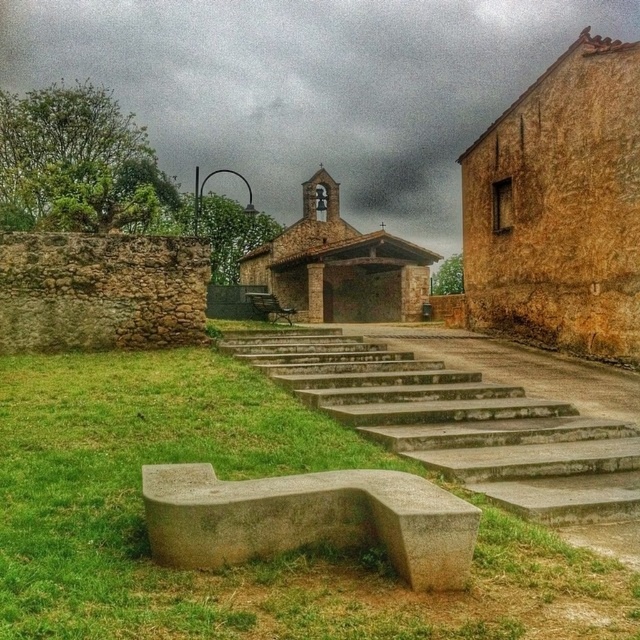
Question: Can you confirm if brown rough stone church at upper right is positioned above brown stone church at center?

Choices:
 (A) yes
 (B) no

Answer: (B)

Question: Estimate the real-world distances between objects in this image. Which object is farther from the brown rough stone church at upper right?

Choices:
 (A) gray concrete bench at lower left
 (B) green grass at lower left
 (C) brown stone church at center

Answer: (C)

Question: Which object is closer to the camera taking this photo?

Choices:
 (A) gray concrete bench at lower left
 (B) concrete stairs at center

Answer: (A)

Question: Which point is farther to the camera?

Choices:
 (A) (516, 99)
 (B) (611, 497)
 (C) (428, 486)

Answer: (A)

Question: In this image, where is brown rough stone church at upper right located relative to brown stone church at center?

Choices:
 (A) below
 (B) above

Answer: (A)

Question: Does brown rough stone church at upper right appear on the left side of concrete stairs at center?

Choices:
 (A) yes
 (B) no

Answer: (B)